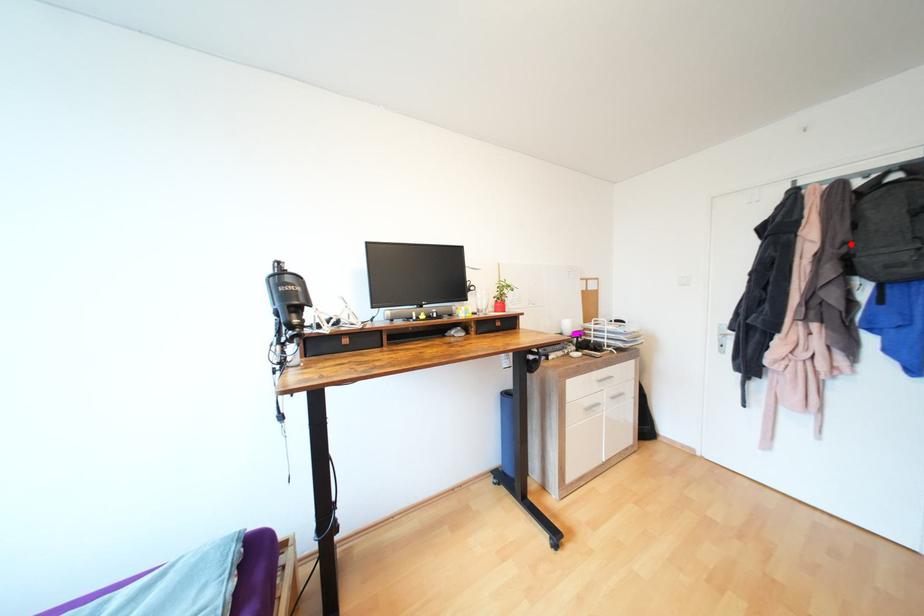
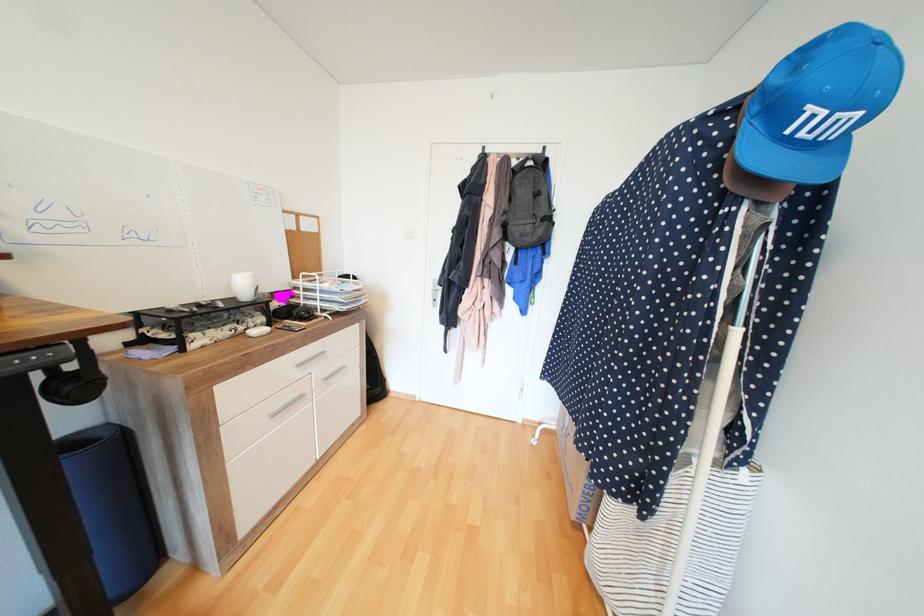
Find the pixel in the second image that matches the highlighted location in the first image.

(511, 213)